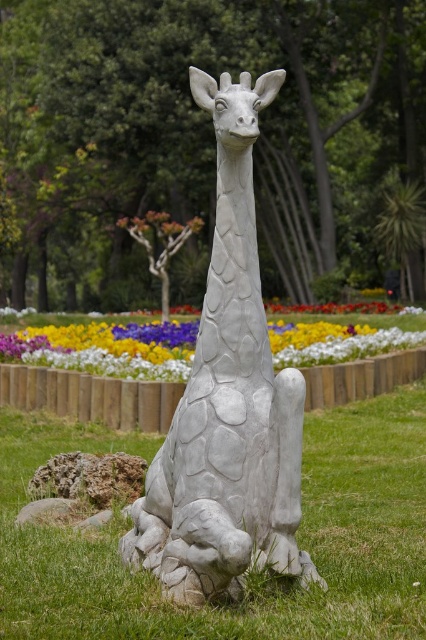
Question: Which object is farther from the camera taking this photo?

Choices:
 (A) white stone giraffe at center
 (B) green grass at lower center
 (C) vibrant multicolored petals at center

Answer: (C)

Question: Where is green grass at lower center located in relation to vibrant multicolored petals at center in the image?

Choices:
 (A) below
 (B) above

Answer: (A)

Question: Which object appears farthest from the camera in this image?

Choices:
 (A) white stone giraffe at center
 (B) green grass at lower center
 (C) vibrant multicolored petals at center

Answer: (C)

Question: Is white stone giraffe at center to the left of vibrant multicolored petals at center from the viewer's perspective?

Choices:
 (A) no
 (B) yes

Answer: (A)

Question: Which point appears farthest from the camera in this image?

Choices:
 (A) (51, 349)
 (B) (299, 579)
 (C) (49, 600)

Answer: (A)

Question: Is green grass at lower center positioned at the back of vibrant multicolored petals at center?

Choices:
 (A) yes
 (B) no

Answer: (B)